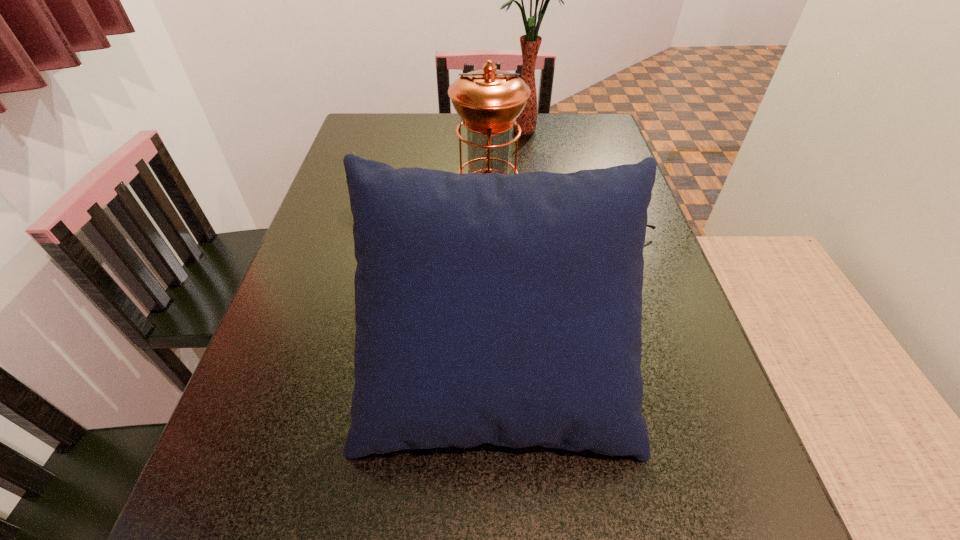
The height and width of the screenshot is (540, 960). I want to click on the farthest object, so click(530, 43).

The width and height of the screenshot is (960, 540). In order to click on flower arrangement in this screenshot , I will do `click(530, 43)`.

At what (x,y) coordinates should I click in order to perform the action: click on oil lamp. Please return your answer as a coordinate pair (x, y). Looking at the image, I should click on (488, 101).

The image size is (960, 540). I want to click on cushion, so click(506, 309).

Find the location of `the leftmost object`. the leftmost object is located at coordinates (352, 151).

You are a GUI agent. You are given a task and a screenshot of the screen. Output one action in this format:
    pyautogui.click(x=<x>, y=<y>)
    Task: Click on the fourth tallest object
    The image size is (960, 540).
    Given the screenshot: What is the action you would take?
    pyautogui.click(x=352, y=151)

The width and height of the screenshot is (960, 540). What are the coordinates of `the rightmost object` in the screenshot? It's located at (653, 227).

Where is `sunglasses`? sunglasses is located at coordinates (653, 227).

Image resolution: width=960 pixels, height=540 pixels. I want to click on vacant region located on the left of the flower arrangement, so click(x=475, y=131).

I want to click on free location located 0.270m on the back of the oil lamp, so click(486, 137).